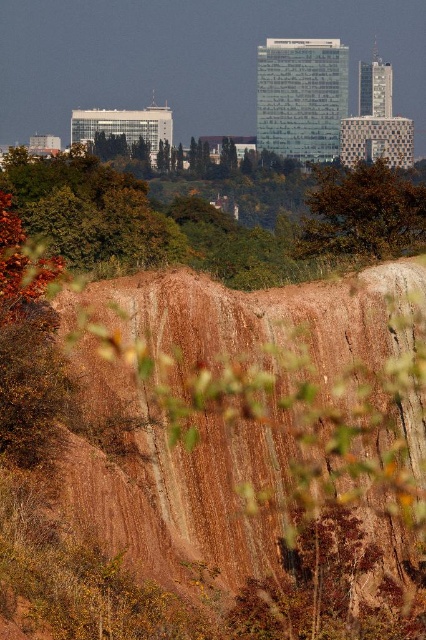
Question: Can you confirm if green leafy tree at upper center is positioned to the right of brown leafy tree at center?

Choices:
 (A) no
 (B) yes

Answer: (A)

Question: From the image, what is the correct spatial relationship of green leafy tree at upper center in relation to brown leafy tree at center?

Choices:
 (A) above
 (B) below

Answer: (B)

Question: Which object is closer to the camera taking this photo?

Choices:
 (A) brown leafy tree at center
 (B) green leafy tree at upper center

Answer: (A)

Question: Does green leafy tree at upper center have a greater width compared to brown leafy tree at center?

Choices:
 (A) no
 (B) yes

Answer: (B)